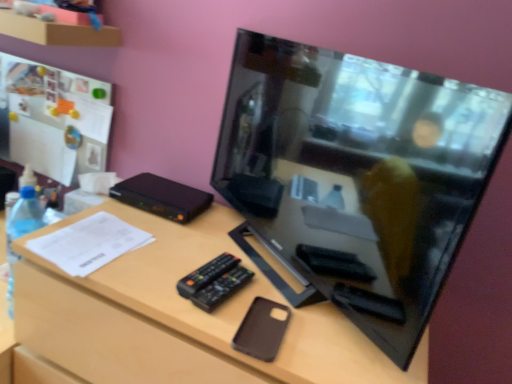
Question: Should I look upward or downward to see black glossy television at center?

Choices:
 (A) up
 (B) down

Answer: (A)

Question: Does black glossy television at center have a smaller size compared to clear plastic bottle at left?

Choices:
 (A) yes
 (B) no

Answer: (B)

Question: Would you consider black glossy television at center to be distant from clear plastic bottle at left?

Choices:
 (A) yes
 (B) no

Answer: (B)

Question: From a real-world perspective, is black glossy television at center on clear plastic bottle at left?

Choices:
 (A) no
 (B) yes

Answer: (B)

Question: Is black glossy television at center at the right side of clear plastic bottle at left?

Choices:
 (A) yes
 (B) no

Answer: (A)

Question: From the image's perspective, is black glossy television at center beneath clear plastic bottle at left?

Choices:
 (A) no
 (B) yes

Answer: (A)

Question: From the image's perspective, is black glossy television at center located above clear plastic bottle at left?

Choices:
 (A) no
 (B) yes

Answer: (B)

Question: Does clear plastic bottle at left appear on the left side of black glossy television at center?

Choices:
 (A) yes
 (B) no

Answer: (A)

Question: Can you confirm if clear plastic bottle at left is smaller than black glossy television at center?

Choices:
 (A) no
 (B) yes

Answer: (B)

Question: Is clear plastic bottle at left bigger than black glossy television at center?

Choices:
 (A) no
 (B) yes

Answer: (A)

Question: From a real-world perspective, does clear plastic bottle at left sit lower than black glossy television at center?

Choices:
 (A) yes
 (B) no

Answer: (A)

Question: Could you tell me if clear plastic bottle at left is turned towards black glossy television at center?

Choices:
 (A) yes
 (B) no

Answer: (B)

Question: Considering the relative sizes of clear plastic bottle at left and black glossy television at center in the image provided, is clear plastic bottle at left shorter than black glossy television at center?

Choices:
 (A) yes
 (B) no

Answer: (A)

Question: From a real-world perspective, is black glossy television at center over brown matte phone case at center?

Choices:
 (A) yes
 (B) no

Answer: (A)